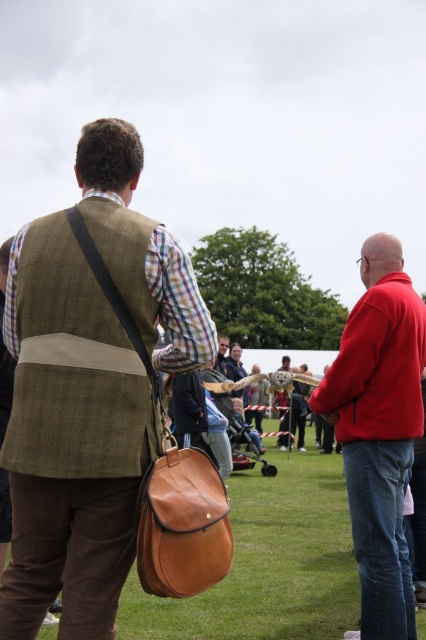
Who is positioned more to the right, matte brown vest at center or red fleece jacket at right?

red fleece jacket at right

The width and height of the screenshot is (426, 640). Describe the element at coordinates (69, 440) in the screenshot. I see `matte brown vest at center` at that location.

This screenshot has width=426, height=640. Identify the location of matte brown vest at center. (69, 440).

Who is positioned more to the left, matte brown vest at center or green matte grass at lower center?

From the viewer's perspective, matte brown vest at center appears more on the left side.

What do you see at coordinates (69, 440) in the screenshot? The height and width of the screenshot is (640, 426). I see `matte brown vest at center` at bounding box center [69, 440].

Locate an element on the screen. The image size is (426, 640). matte brown vest at center is located at coordinates (69, 440).

Can you confirm if green matte grass at lower center is positioned below red fleece jacket at right?

Correct, green matte grass at lower center is located below red fleece jacket at right.

Is green matte grass at lower center closer to camera compared to red fleece jacket at right?

No, it is behind red fleece jacket at right.

The image size is (426, 640). What do you see at coordinates (268, 563) in the screenshot?
I see `green matte grass at lower center` at bounding box center [268, 563].

Identify the location of green matte grass at lower center. This screenshot has height=640, width=426. (268, 563).